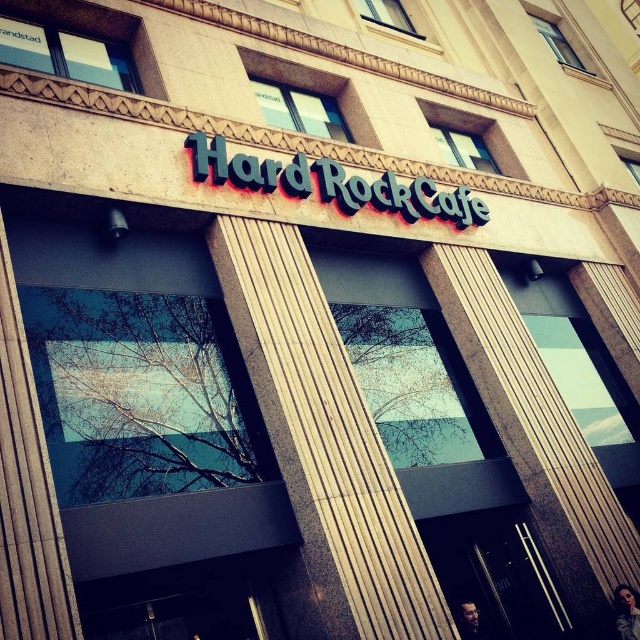
Question: Does wooden pillar at center appear on the right side of blue metallic sign at center?

Choices:
 (A) yes
 (B) no

Answer: (B)

Question: Is wooden pillar at center positioned in front of blue metallic sign at center?

Choices:
 (A) no
 (B) yes

Answer: (B)

Question: Can you confirm if wooden pillar at center is thinner than blue metallic sign at center?

Choices:
 (A) yes
 (B) no

Answer: (A)